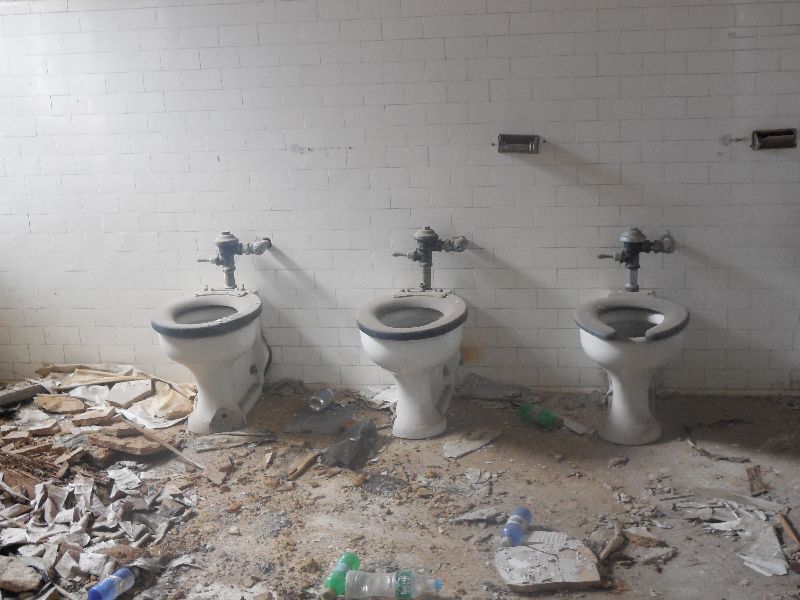
What are the coordinates of `toilet` in the screenshot? It's located at (626, 360).